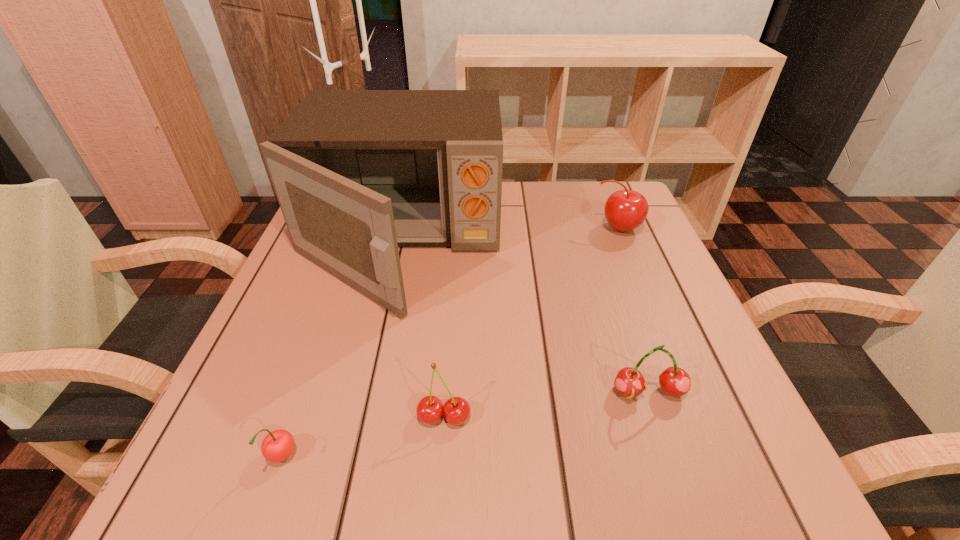
Locate an element on the screen. vacant space at the right edge of the desktop is located at coordinates (657, 330).

You are a GUI agent. You are given a task and a screenshot of the screen. Output one action in this format:
    pyautogui.click(x=<x>, y=<y>)
    Task: Click on the blank space at the far right corner of the desktop
    This screenshot has width=960, height=540.
    Given the screenshot: What is the action you would take?
    pyautogui.click(x=617, y=186)

Where is `free space that is in between the third cherry from right to left and the farthest cherry`? The width and height of the screenshot is (960, 540). free space that is in between the third cherry from right to left and the farthest cherry is located at coordinates (531, 323).

Locate an element on the screen. The width and height of the screenshot is (960, 540). free space between the farthest cherry and the leftmost cherry is located at coordinates (449, 343).

This screenshot has width=960, height=540. In order to click on empty space between the tallest object and the farthest cherry in this screenshot , I will do `click(509, 235)`.

You are a GUI agent. You are given a task and a screenshot of the screen. Output one action in this format:
    pyautogui.click(x=<x>, y=<y>)
    Task: Click on the free space between the second cherry from left to right and the tallest object
    
    Given the screenshot: What is the action you would take?
    pyautogui.click(x=422, y=329)

Locate an element on the screen. This screenshot has width=960, height=540. free space between the nearest object and the microwave oven is located at coordinates (341, 350).

Find the location of a particular element. The image size is (960, 540). empty space that is in between the farthest cherry and the microwave oven is located at coordinates (509, 235).

You are a GUI agent. You are given a task and a screenshot of the screen. Output one action in this format:
    pyautogui.click(x=<x>, y=<y>)
    Task: Click on the vacant space that is in between the microwave oven and the second cherry from left to right
    
    Given the screenshot: What is the action you would take?
    pyautogui.click(x=422, y=329)

Locate which object is the closest to the shortest cherry. Please provide its 2D coordinates. Your answer should be formatted as a tuple, i.e. [(x, y)], where the tuple contains the x and y coordinates of a point satisfying the conditions above.

[(430, 409)]